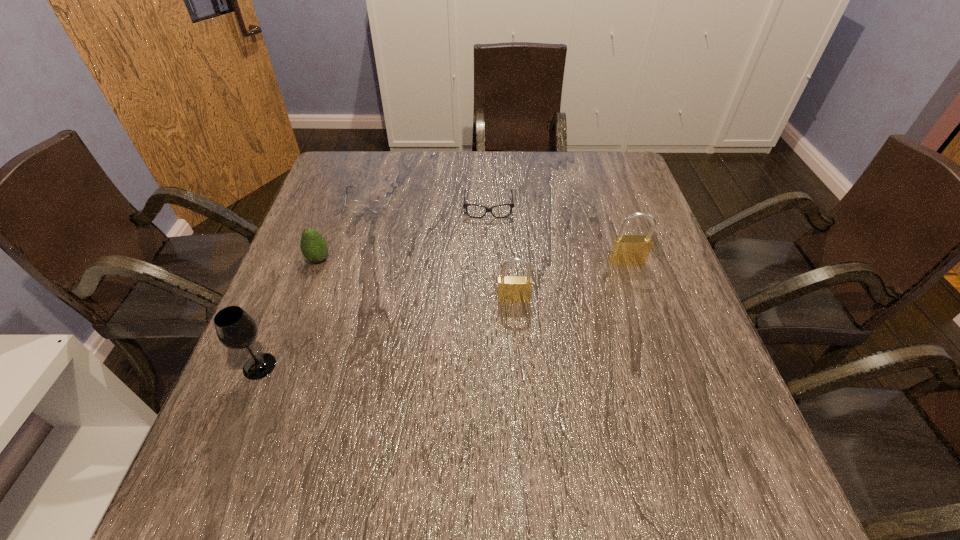
Image resolution: width=960 pixels, height=540 pixels. Identify the location of vacant region located on the front of the third shortest object. click(299, 313).

This screenshot has height=540, width=960. Find the location of `vacant area located 0.110m on the front-facing side of the right spectacles`. vacant area located 0.110m on the front-facing side of the right spectacles is located at coordinates (490, 248).

Find the location of a particular element. vacant area situated on the right of the wineglass is located at coordinates (419, 366).

Locate an element on the screen. vacant space located 0.360m through the lenses of the left spectacles is located at coordinates (337, 316).

Locate an element on the screen. object at the far edge is located at coordinates (355, 206).

Locate an element on the screen. This screenshot has height=540, width=960. avocado present at the left edge is located at coordinates (314, 247).

At what (x,y) coordinates should I click in order to perform the action: click on wineglass at the left edge. Please return your answer as a coordinate pair (x, y). The image size is (960, 540). Looking at the image, I should click on (235, 328).

In order to click on spectacles that is positioned at the left edge in this screenshot , I will do `click(355, 206)`.

In order to click on object located at the right edge in this screenshot , I will do `click(627, 250)`.

The height and width of the screenshot is (540, 960). I want to click on object present at the far left corner, so click(355, 206).